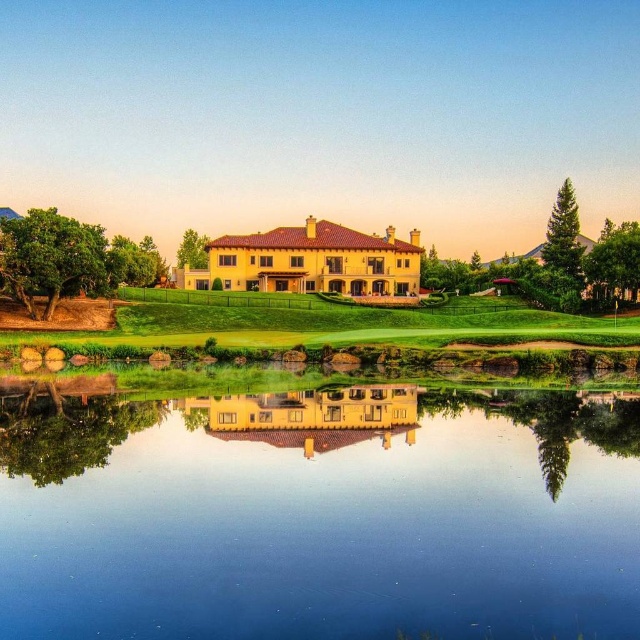
Can you confirm if transparent glass water at center is smaller than green grass at center?

No, transparent glass water at center is not smaller than green grass at center.

Does transparent glass water at center appear on the right side of green grass at center?

Correct, you'll find transparent glass water at center to the right of green grass at center.

The image size is (640, 640). What do you see at coordinates (317, 515) in the screenshot?
I see `transparent glass water at center` at bounding box center [317, 515].

The image size is (640, 640). Find the location of `transparent glass water at center`. transparent glass water at center is located at coordinates (317, 515).